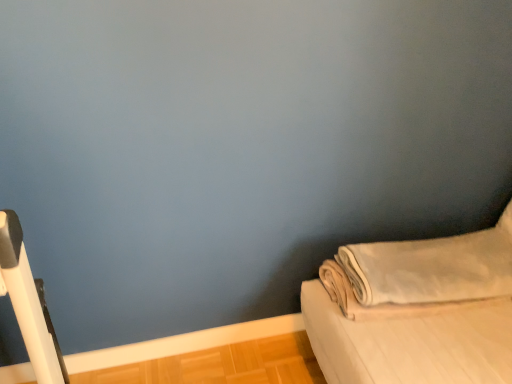
Locate an element on the screen. The image size is (512, 384). free point above beige fabric bed at lower right (from a real-world perspective) is located at coordinates (415, 258).